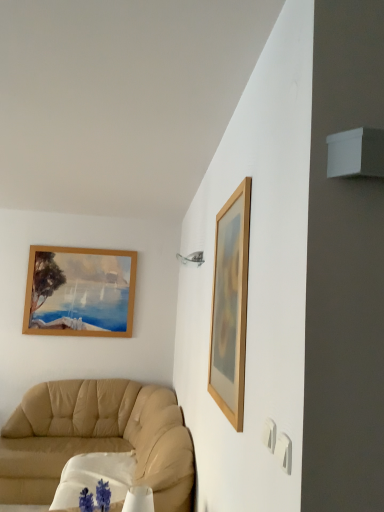
Question: From the image's perspective, is white fabric round table at lower left on top of wooden picture frame at upper right?

Choices:
 (A) no
 (B) yes

Answer: (A)

Question: Does white fabric round table at lower left have a greater height compared to wooden picture frame at upper right?

Choices:
 (A) yes
 (B) no

Answer: (B)

Question: Is wooden picture frame at upper right located within white fabric round table at lower left?

Choices:
 (A) no
 (B) yes

Answer: (A)

Question: Is white fabric round table at lower left next to wooden picture frame at upper right?

Choices:
 (A) no
 (B) yes

Answer: (A)

Question: Is wooden picture frame at upper right at the back of white fabric round table at lower left?

Choices:
 (A) yes
 (B) no

Answer: (B)

Question: Is white fabric round table at lower left far from wooden picture frame at upper right?

Choices:
 (A) no
 (B) yes

Answer: (B)

Question: Is wooden picture frame at upper right bigger than white fabric round table at lower left?

Choices:
 (A) no
 (B) yes

Answer: (A)

Question: Considering the relative sizes of wooden picture frame at upper right and white fabric round table at lower left in the image provided, is wooden picture frame at upper right taller than white fabric round table at lower left?

Choices:
 (A) yes
 (B) no

Answer: (A)

Question: Is wooden picture frame at upper right positioned behind white fabric round table at lower left?

Choices:
 (A) yes
 (B) no

Answer: (B)

Question: Considering the relative positions of wooden picture frame at upper right and white fabric round table at lower left in the image provided, is wooden picture frame at upper right to the right of white fabric round table at lower left from the viewer's perspective?

Choices:
 (A) no
 (B) yes

Answer: (B)

Question: Is wooden picture frame at upper right turned away from white fabric round table at lower left?

Choices:
 (A) yes
 (B) no

Answer: (B)

Question: From the image's perspective, is wooden picture frame at upper right beneath white fabric round table at lower left?

Choices:
 (A) yes
 (B) no

Answer: (B)

Question: From a real-world perspective, is wooden picture frame at upper right positioned under beige leather couch at lower left based on gravity?

Choices:
 (A) yes
 (B) no

Answer: (B)